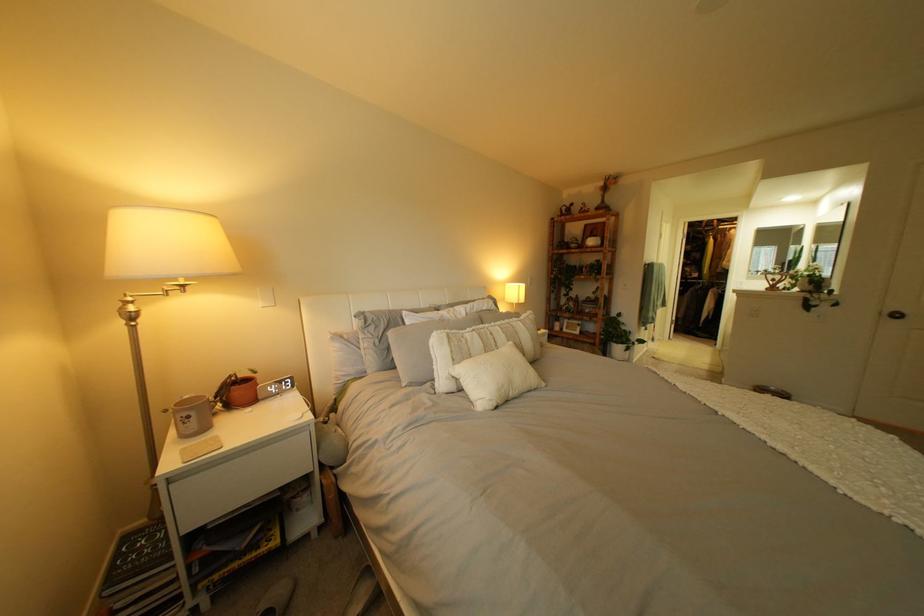
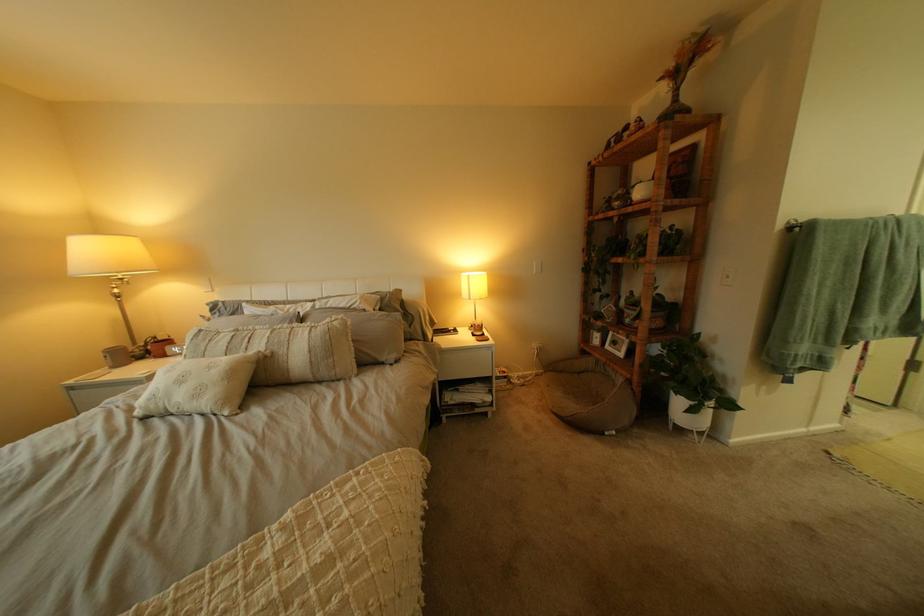
The point at (616, 192) is marked in the first image. Where is the corresponding point in the second image?

(675, 81)